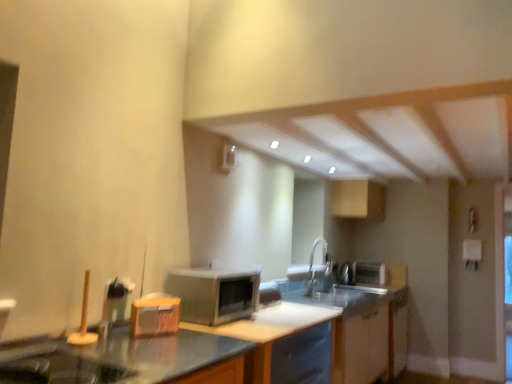
Question: From the image's perspective, does satin silver microwave at center appear lower than white glossy cabinet at lower center, the first cabinetry positioned from the bottom?

Choices:
 (A) no
 (B) yes

Answer: (A)

Question: Is satin silver microwave at center located outside white glossy cabinet at lower center, the second cabinetry from the back?

Choices:
 (A) yes
 (B) no

Answer: (A)

Question: Is white glossy cabinet at lower center, the first cabinetry positioned from the bottom, located within satin silver microwave at center?

Choices:
 (A) yes
 (B) no

Answer: (B)

Question: Is satin silver microwave at center behind white glossy cabinet at lower center, the first cabinetry positioned from the bottom?

Choices:
 (A) yes
 (B) no

Answer: (B)

Question: Is satin silver microwave at center to the right of white glossy cabinet at lower center, the second cabinetry from the back, from the viewer's perspective?

Choices:
 (A) yes
 (B) no

Answer: (B)

Question: From the image's perspective, relative to white glossy cabinet at lower center, which is the 1th cabinetry in front-to-back order, is white glossy counter top at center above or below?

Choices:
 (A) above
 (B) below

Answer: (A)

Question: Considering the positions of white glossy counter top at center and white glossy cabinet at lower center, the first cabinetry positioned from the bottom, in the image, is white glossy counter top at center wider or thinner than white glossy cabinet at lower center, the first cabinetry positioned from the bottom,?

Choices:
 (A) thin
 (B) wide

Answer: (A)

Question: Considering the positions of point (286, 327) and point (356, 321), is point (286, 327) closer or farther from the camera than point (356, 321)?

Choices:
 (A) farther
 (B) closer

Answer: (B)

Question: Based on their positions, is white glossy counter top at center located to the left or right of white glossy cabinet at lower center, which is the 1th cabinetry in front-to-back order?

Choices:
 (A) left
 (B) right

Answer: (A)

Question: Do you think satin silver toaster at upper right, the 1th appliance from the bottom, is within white glossy cabinet at lower center, the first cabinetry positioned from the bottom, or outside of it?

Choices:
 (A) inside
 (B) outside

Answer: (B)

Question: Considering the positions of satin silver toaster at upper right, which is counted as the first appliance, starting from the right, and white glossy cabinet at lower center, the first cabinetry positioned from the bottom, in the image, is satin silver toaster at upper right, which is counted as the first appliance, starting from the right, wider or thinner than white glossy cabinet at lower center, the first cabinetry positioned from the bottom,?

Choices:
 (A) wide
 (B) thin

Answer: (B)

Question: Is satin silver toaster at upper right, positioned as the second appliance in front-to-back order, taller or shorter than white glossy cabinet at lower center, the second cabinetry from the back?

Choices:
 (A) short
 (B) tall

Answer: (A)

Question: From the image's perspective, is satin silver toaster at upper right, positioned as the second appliance in front-to-back order, positioned above or below white glossy cabinet at lower center, which is the 1th cabinetry in front-to-back order?

Choices:
 (A) below
 (B) above

Answer: (B)

Question: Choose the correct answer: Is satin silver microwave at center inside satin silver toaster at upper right, positioned as the second appliance in front-to-back order, or outside it?

Choices:
 (A) inside
 (B) outside

Answer: (B)

Question: From the image's perspective, relative to satin silver toaster at upper right, positioned as the 2th appliance in left-to-right order, is satin silver microwave at center above or below?

Choices:
 (A) above
 (B) below

Answer: (A)